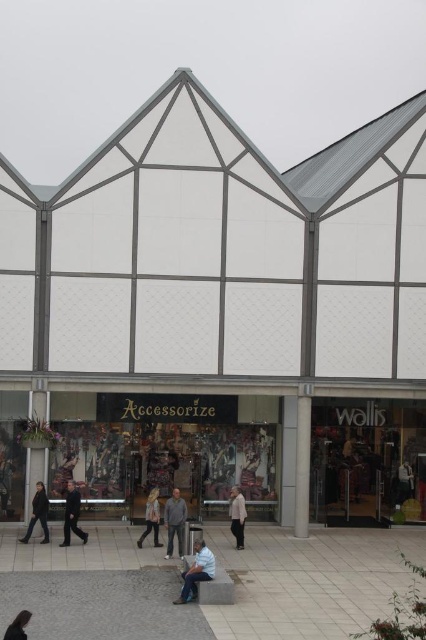
Who is higher up, dark gray suit at center or dark brown leather jacket at lower left?

dark brown leather jacket at lower left

Is point (77, 525) closer to camera compared to point (25, 541)?

No, it is behind (25, 541).

Where is `dark gray suit at center`? dark gray suit at center is located at coordinates (71, 515).

Between matte black clothing store at lower center and dark brown hair at upper left, which one is positioned higher?

matte black clothing store at lower center is above.

Between matte black clothing store at lower center and dark brown hair at upper left, which one has more height?

With more height is matte black clothing store at lower center.

Is point (310, 493) positioned behind point (22, 636)?

Yes.

Image resolution: width=426 pixels, height=640 pixels. Identify the location of matte black clothing store at lower center. (173, 451).

Can you confirm if gray cotton shirt at center is thinner than dark gray suit at center?

Yes.

Who is higher up, gray cotton shirt at center or dark gray suit at center?

dark gray suit at center is above.

Is point (178, 536) closer to camera compared to point (77, 513)?

Yes, it is in front of point (77, 513).

Identify the location of gray cotton shirt at center. The image size is (426, 640). (175, 522).